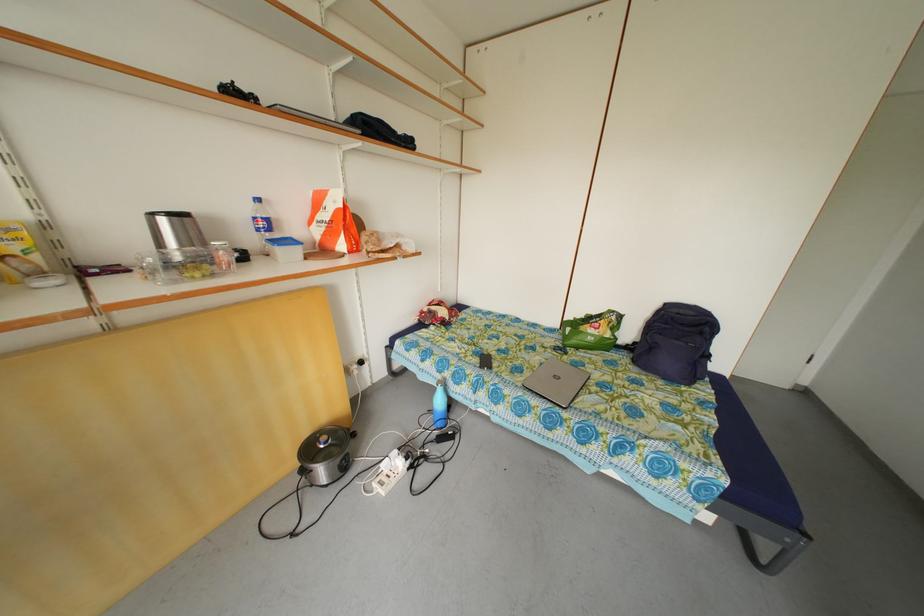
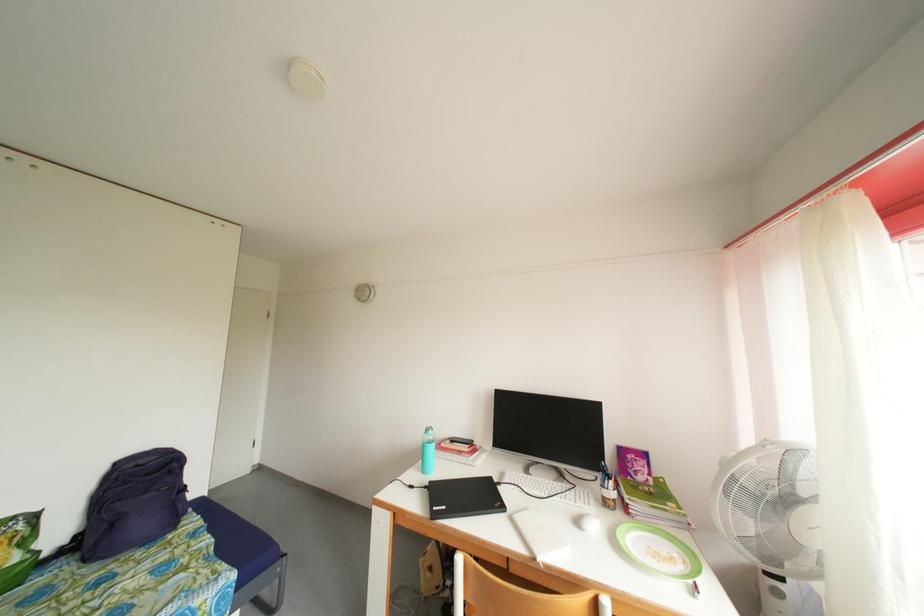
Find the pixel in the second image that matches pixel 673 310 in the first image.

(124, 469)